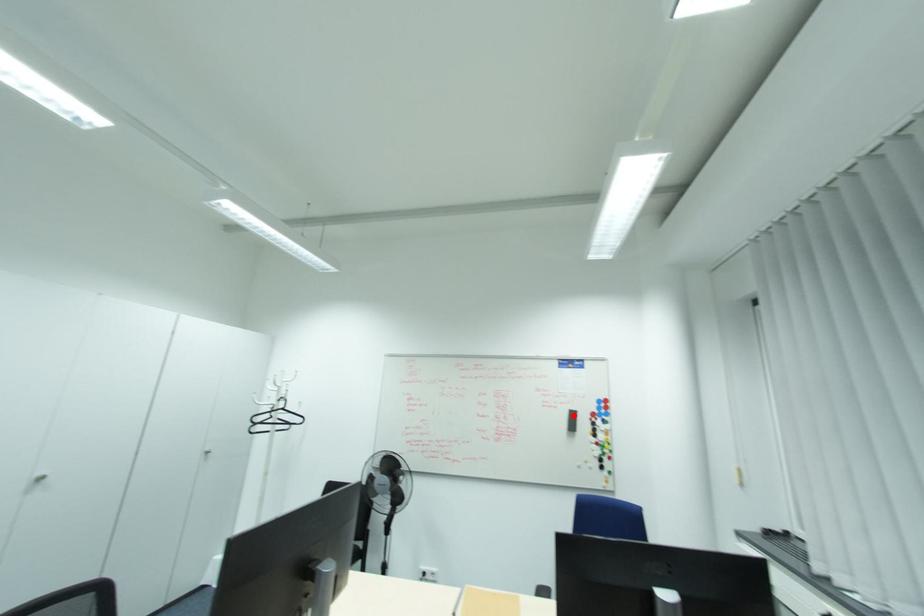
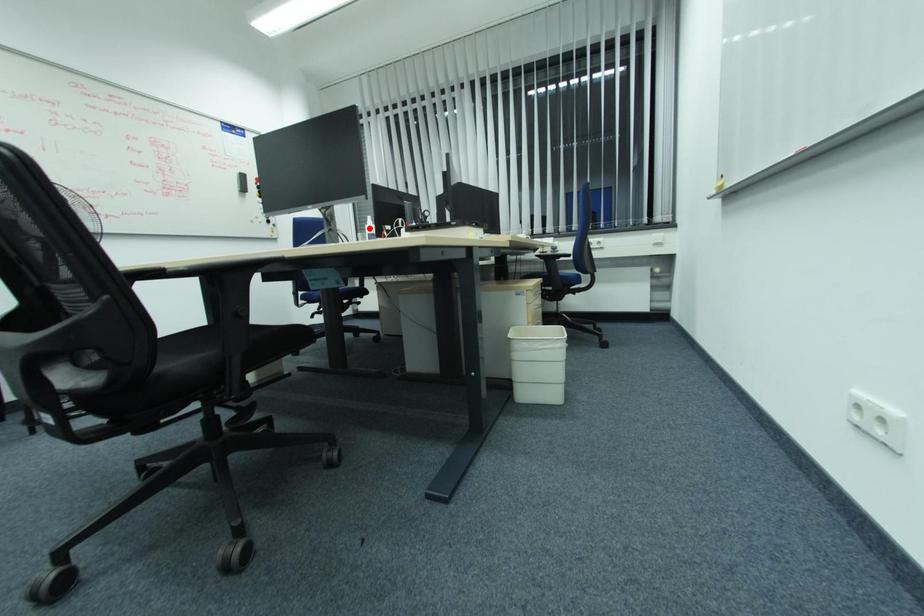
From the picture: I am providing you with two images of the same scene from different viewpoints. A red point is marked on the first image and another point is marked on the second image. Are the points marked in image1 and image2 representing the same 3D position?

No